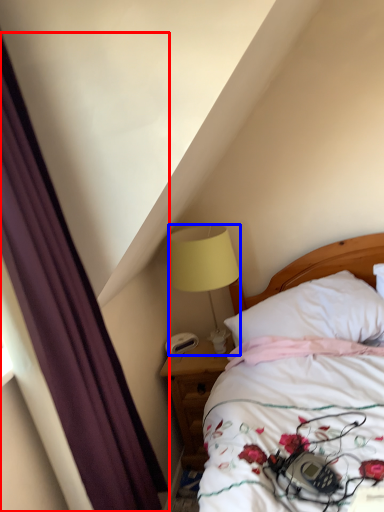
Question: Which of the following is the farthest to the observer, curtain (highlighted by a red box) or lamp (highlighted by a blue box)?

Choices:
 (A) curtain
 (B) lamp

Answer: (B)